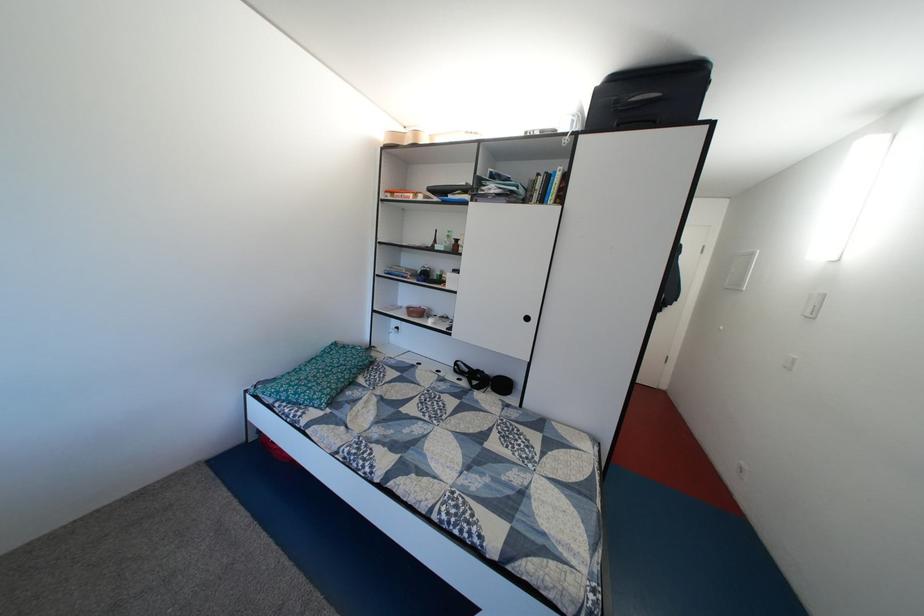
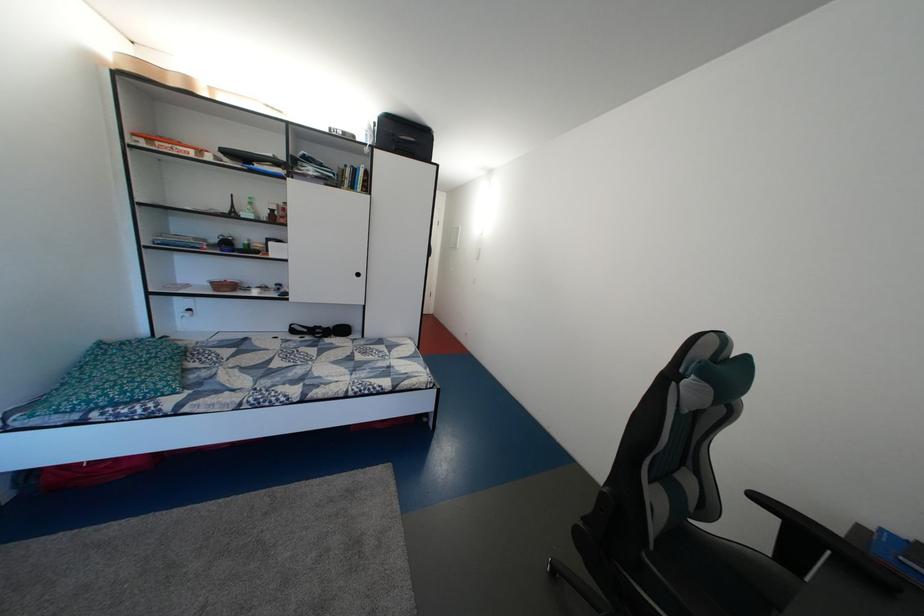
The point at (484, 495) is marked in the first image. Where is the corresponding point in the second image?

(373, 382)